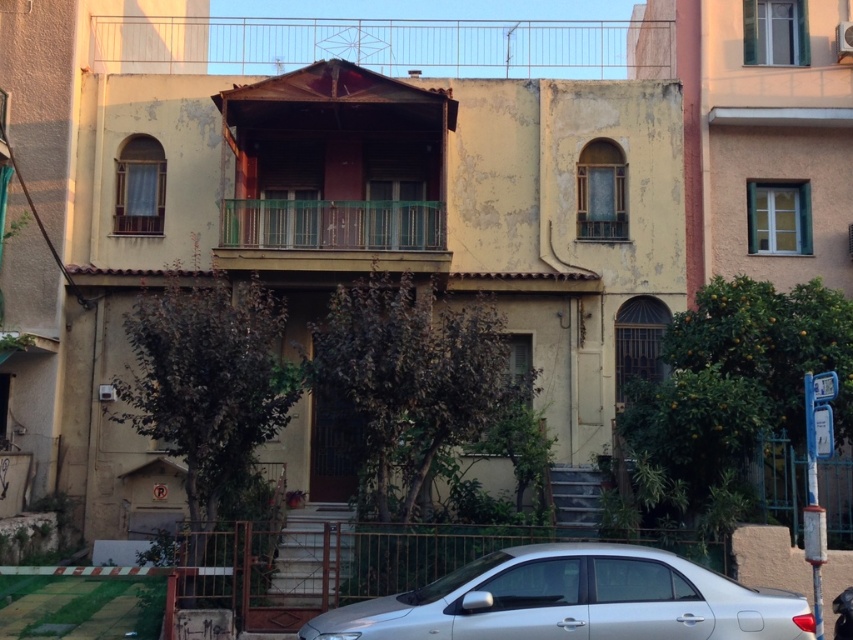
Which of these two, silver metallic car at lower center or green glass railing at center, stands shorter?

Standing shorter between the two is silver metallic car at lower center.

Is silver metallic car at lower center closer to camera compared to green glass railing at center?

Yes, silver metallic car at lower center is closer to the viewer.

Does point (651, 589) come closer to viewer compared to point (289, 236)?

Yes, point (651, 589) is closer to viewer.

The height and width of the screenshot is (640, 853). I want to click on silver metallic car at lower center, so click(573, 600).

Which is below, silver metallic car at lower center or rustic wood balcony at upper center?

silver metallic car at lower center

Is silver metallic car at lower center bigger than rustic wood balcony at upper center?

No, silver metallic car at lower center is not bigger than rustic wood balcony at upper center.

Is point (328, 618) closer to camera compared to point (668, 74)?

Yes, it is.

I want to click on silver metallic car at lower center, so click(573, 600).

Consider the image. Is rustic wood balcony at upper center wider than green glass railing at center?

Indeed, rustic wood balcony at upper center has a greater width compared to green glass railing at center.

Does point (553, 36) come closer to viewer compared to point (384, 216)?

No, it is behind (384, 216).

Is point (550, 54) behind point (374, 214)?

Yes, it is.

Locate an element on the screen. The image size is (853, 640). rustic wood balcony at upper center is located at coordinates (383, 45).